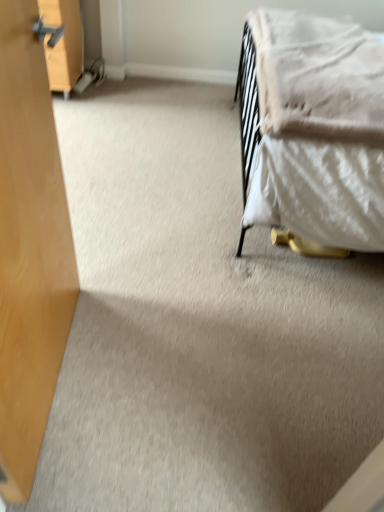
Question: In the image, is soft pink quilt at right on the left side or the right side of wooden drawer at upper left?

Choices:
 (A) left
 (B) right

Answer: (B)

Question: Considering the positions of soft pink quilt at right and wooden drawer at upper left in the image, is soft pink quilt at right wider or thinner than wooden drawer at upper left?

Choices:
 (A) thin
 (B) wide

Answer: (B)

Question: From the image's perspective, is soft pink quilt at right positioned above or below wooden drawer at upper left?

Choices:
 (A) below
 (B) above

Answer: (A)

Question: Considering the positions of wooden drawer at upper left and soft pink quilt at right in the image, is wooden drawer at upper left wider or thinner than soft pink quilt at right?

Choices:
 (A) wide
 (B) thin

Answer: (B)

Question: Is wooden drawer at upper left to the left or to the right of soft pink quilt at right in the image?

Choices:
 (A) right
 (B) left

Answer: (B)

Question: In the image, is wooden drawer at upper left positioned in front of or behind soft pink quilt at right?

Choices:
 (A) behind
 (B) front

Answer: (A)

Question: From their relative heights in the image, would you say wooden drawer at upper left is taller or shorter than soft pink quilt at right?

Choices:
 (A) tall
 (B) short

Answer: (A)